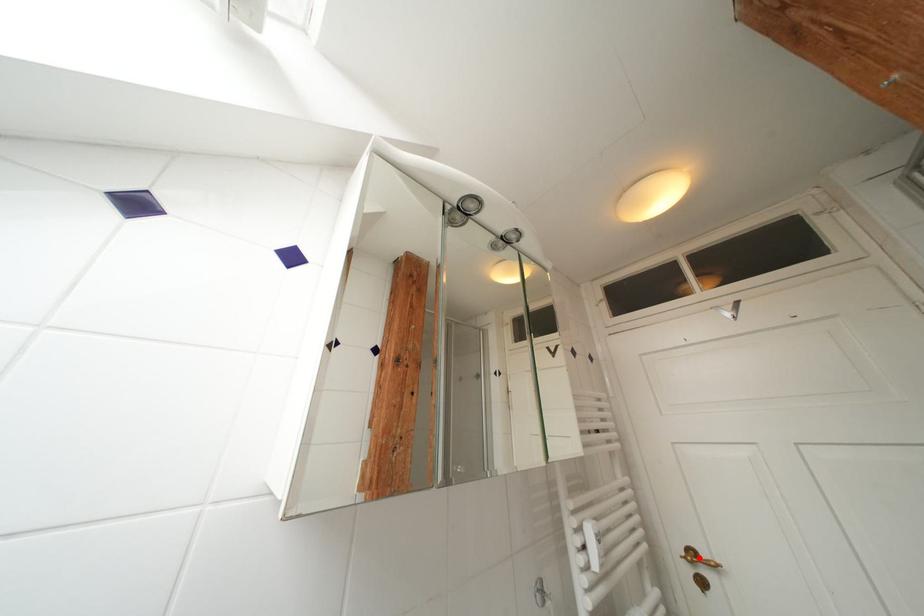
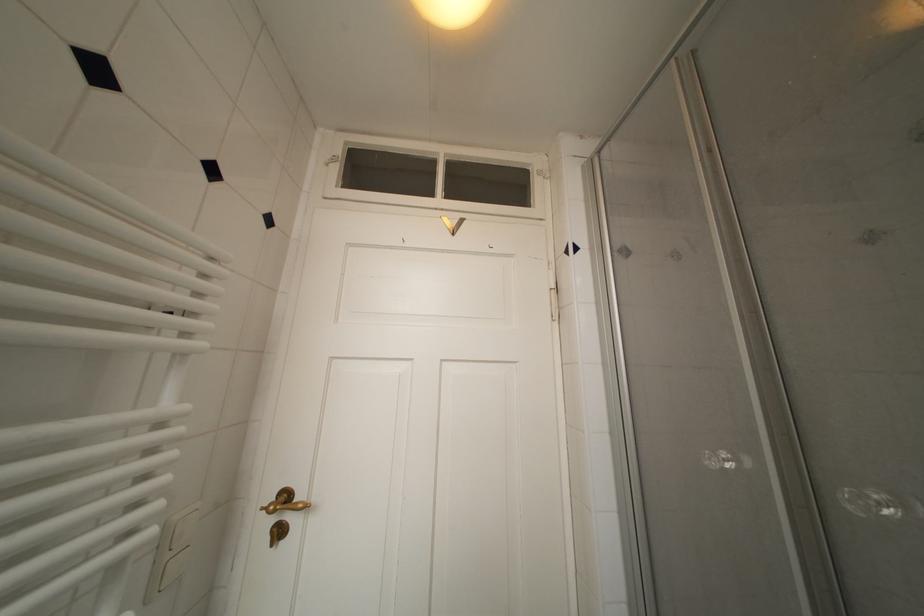
Locate, in the second image, the point that corresponds to the highlighted location in the first image.

(293, 500)